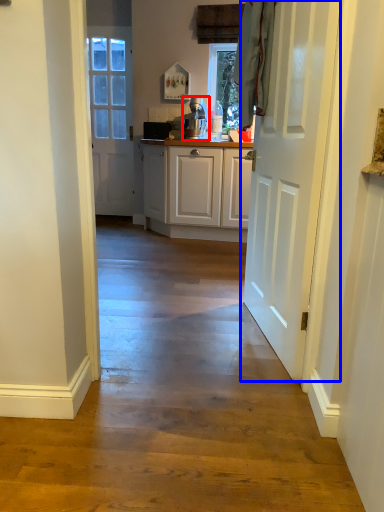
Question: Which of the following is the farthest to the observer, appliance (highlighted by a red box) or door (highlighted by a blue box)?

Choices:
 (A) appliance
 (B) door

Answer: (A)